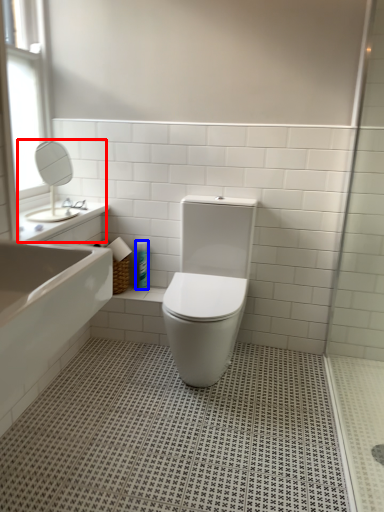
Question: Which point is further to the camera, sink (highlighted by a red box) or toiletry (highlighted by a blue box)?

Choices:
 (A) sink
 (B) toiletry

Answer: (B)